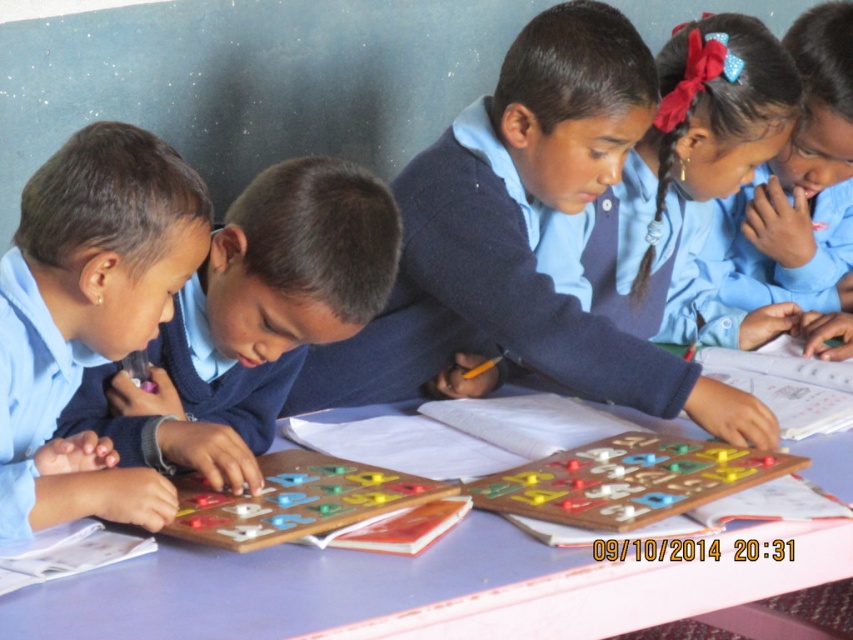
Is blue uniform at upper right positioned at the back of wooden game board at center?

Yes, blue uniform at upper right is further from the viewer.

Locate an element on the screen. blue uniform at upper right is located at coordinates 798,188.

Does point (730, 96) lie behind point (618, 492)?

That is True.

Between blue uniform at center and wooden board game at center, which one appears on the right side from the viewer's perspective?

blue uniform at center is more to the right.

The width and height of the screenshot is (853, 640). In order to click on blue uniform at center in this screenshot , I will do `click(691, 163)`.

Which is in front, point (396, 588) or point (740, 465)?

Point (396, 588)

Who is more forward, (x=33, y=605) or (x=511, y=477)?

Point (x=33, y=605)

Find the location of `purple plastic table at center`. purple plastic table at center is located at coordinates (405, 589).